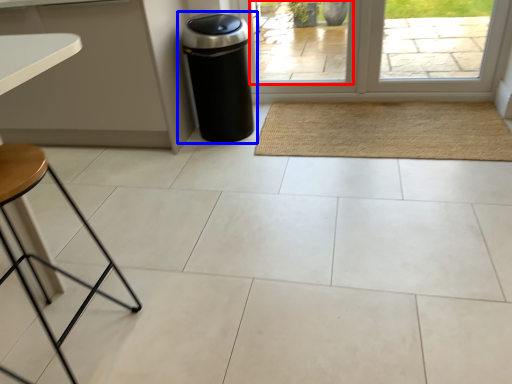
Question: Among these objects, which one is nearest to the camera, window (highlighted by a red box) or waste container (highlighted by a blue box)?

Choices:
 (A) window
 (B) waste container

Answer: (B)